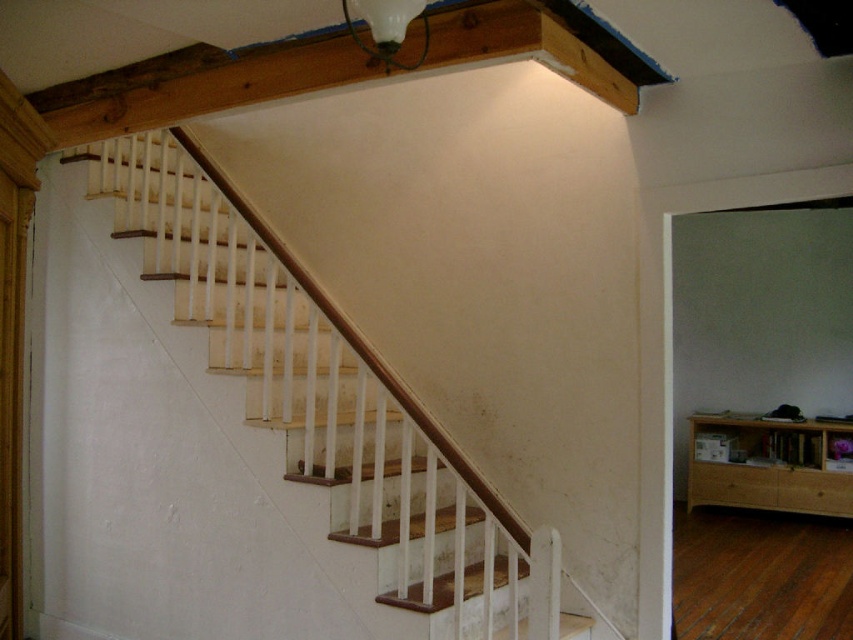
Does wooden stairs at center appear over matte glass lamp at upper center?

No, wooden stairs at center is not above matte glass lamp at upper center.

Does point (250, 301) come closer to viewer compared to point (386, 56)?

No, it is behind (386, 56).

At what (x,y) coordinates should I click in order to perform the action: click on wooden stairs at center. Please return your answer as a coordinate pair (x, y). The image size is (853, 640). Looking at the image, I should click on (328, 396).

Is wooden stairs at center thinner than light brown wood at upper right?

In fact, wooden stairs at center might be wider than light brown wood at upper right.

Is point (120, 221) positioned before point (726, 481)?

That is True.

Who is more forward, (212,161) or (784,474)?

Point (212,161)

The width and height of the screenshot is (853, 640). Find the location of `wooden stairs at center`. wooden stairs at center is located at coordinates (328, 396).

Consider the image. Who is lower down, light brown wood at upper right or matte glass lamp at upper center?

light brown wood at upper right is lower down.

Between point (759, 438) and point (402, 20), which one is positioned behind?

Positioned behind is point (759, 438).

Locate an element on the screen. light brown wood at upper right is located at coordinates (769, 465).